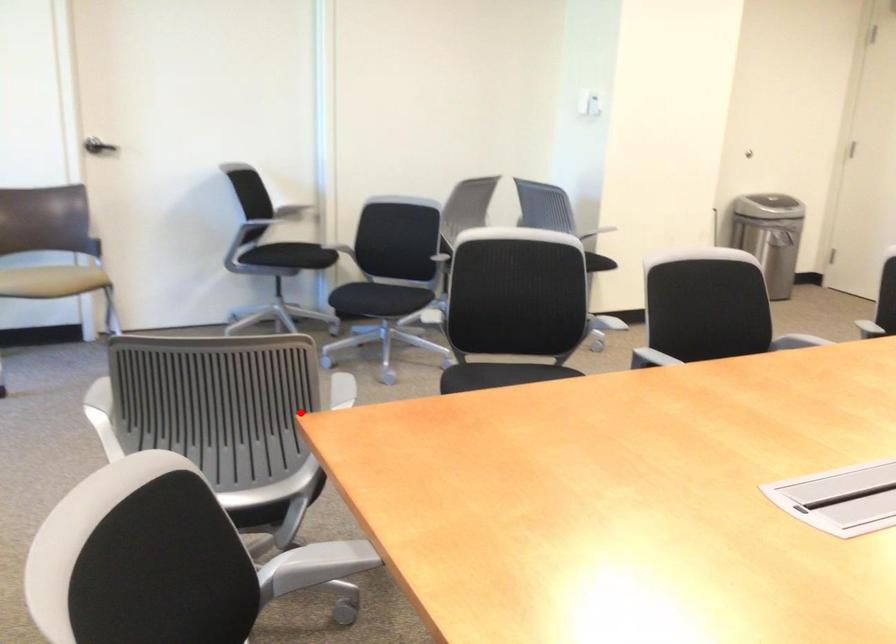
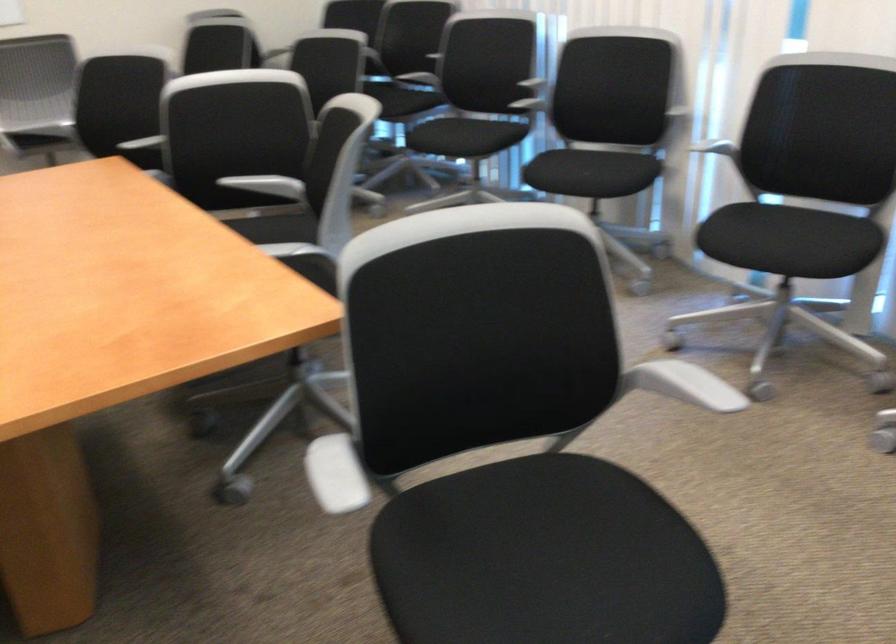
Question: I am providing you with two images of the same scene from different viewpoints. Image1 has a red point marked. In image2, the corresponding 3D location appears at what relative position? Reply with the corresponding letter.

Choices:
 (A) Closer
 (B) Farther

Answer: (A)